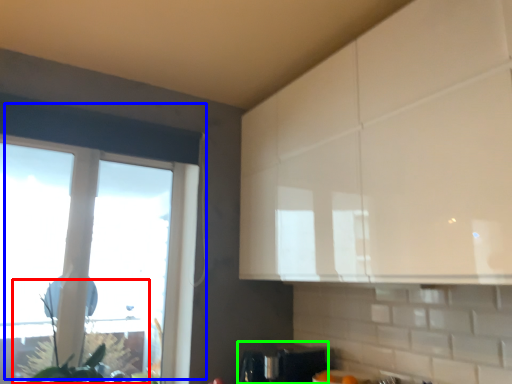
Question: Which object is positioned farthest from plant (highlighted by a red box)? Select from window (highlighted by a blue box) and appliance (highlighted by a green box).

Choices:
 (A) window
 (B) appliance

Answer: (A)